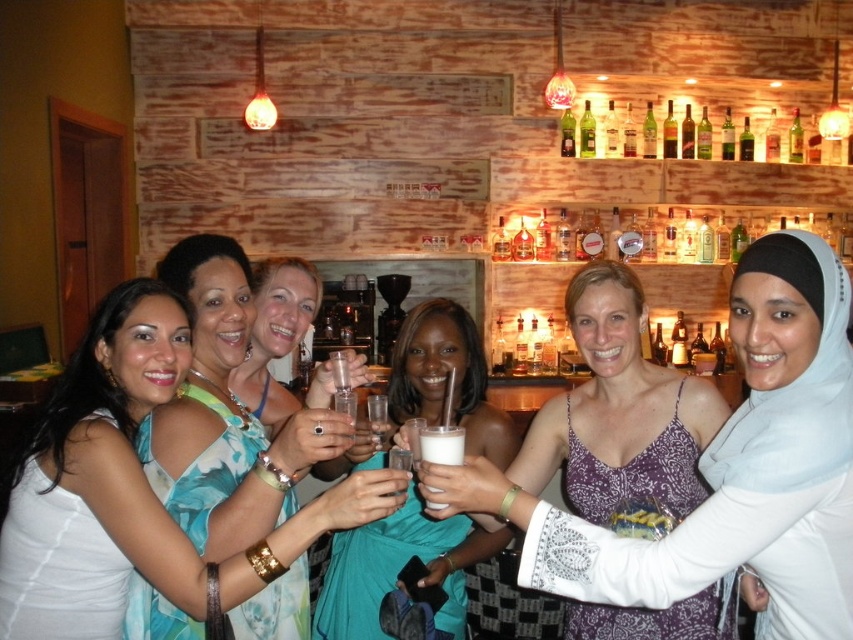
Describe the element at coordinates (730, 468) in the screenshot. I see `white lace dress at center` at that location.

Can you confirm if white lace dress at center is smaller than translucent glass bottle at center?

Actually, white lace dress at center might be larger than translucent glass bottle at center.

You are a GUI agent. You are given a task and a screenshot of the screen. Output one action in this format:
    pyautogui.click(x=<x>, y=<y>)
    Task: Click on the white lace dress at center
    
    Given the screenshot: What is the action you would take?
    pyautogui.click(x=730, y=468)

The width and height of the screenshot is (853, 640). I want to click on white lace dress at center, so click(x=730, y=468).

Is point (375, 419) positioned before point (732, 125)?

Yes, point (375, 419) is closer to viewer.

I want to click on clear glass at center, so click(x=376, y=419).

Where is `clear glass at center`? clear glass at center is located at coordinates (376, 419).

Is white fabric dress at center below clear glass at center?

Indeed, white fabric dress at center is positioned under clear glass at center.

At what (x,y) coordinates should I click in order to perform the action: click on white fabric dress at center. Please return your answer as a coordinate pair (x, y). Image resolution: width=853 pixels, height=640 pixels. Looking at the image, I should click on (132, 492).